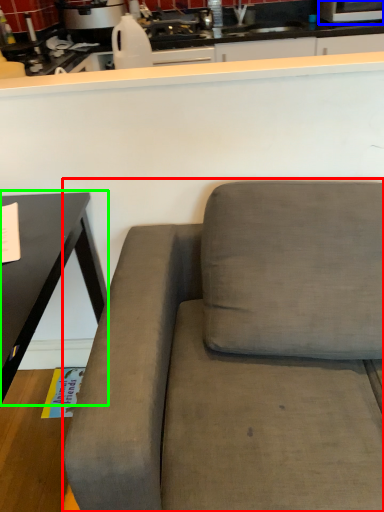
Question: Estimate the real-world distances between objects in this image. Which object is farther from studio couch (highlighted by a red box), appliance (highlighted by a blue box) or table (highlighted by a green box)?

Choices:
 (A) appliance
 (B) table

Answer: (A)